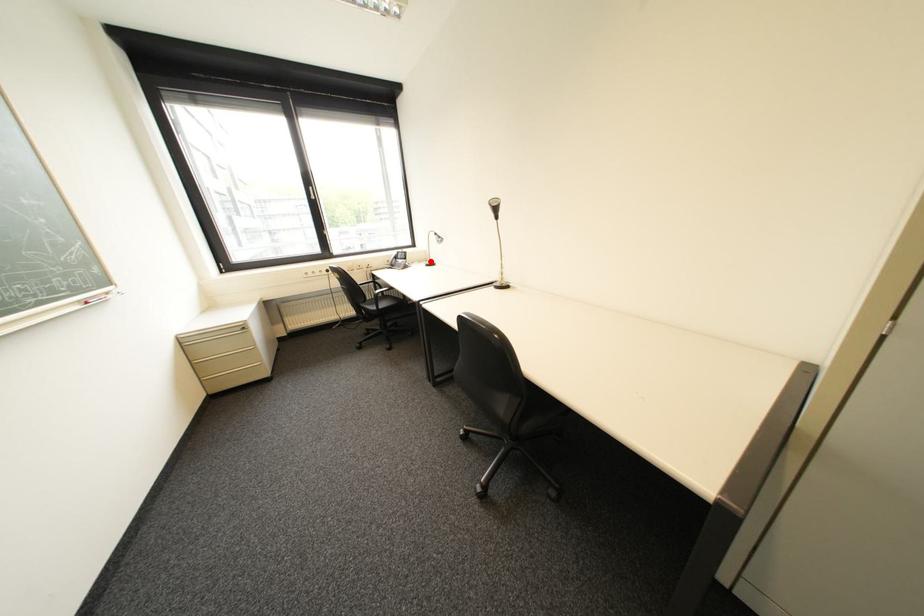
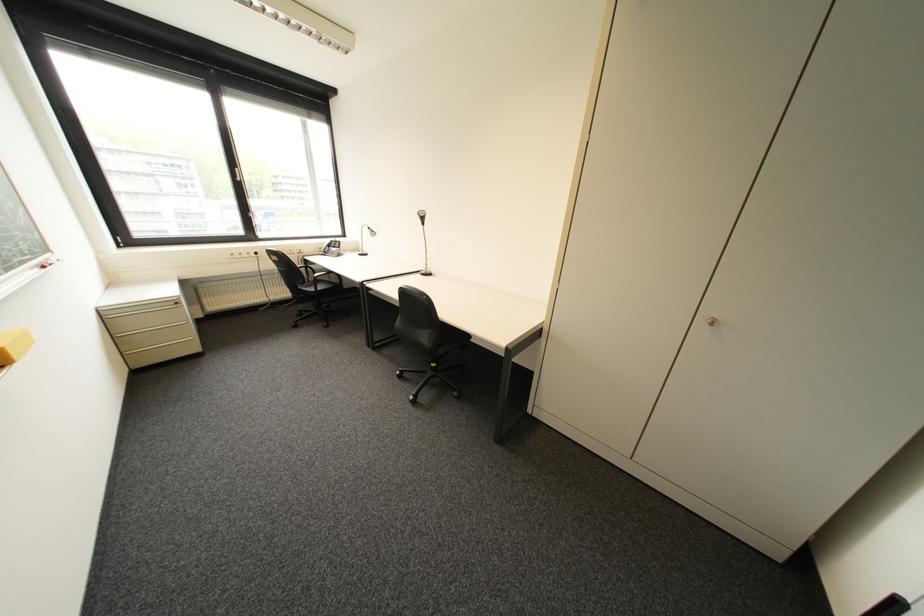
In the second image, find the point that corresponds to the highlighted location in the first image.

(362, 252)